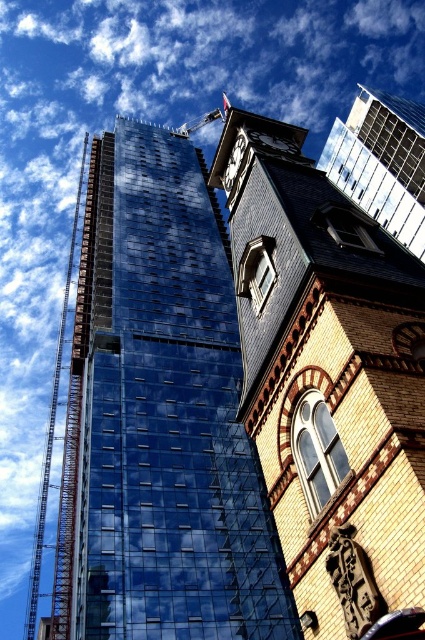
Question: Which of the following is the closest to the observer?

Choices:
 (A) yellow brick clock tower at upper center
 (B) black metal clock at upper center
 (C) metallic scaffolding at left

Answer: (A)

Question: In this image, where is glassy reflective skyscraper at upper center located relative to polished brass clock at upper center?

Choices:
 (A) below
 (B) above

Answer: (B)

Question: Which object is positioned farthest from the polished brass clock at upper center?

Choices:
 (A) shiny glass building at center
 (B) glassy reflective skyscraper at upper center
 (C) black metal clock at upper center
 (D) yellow brick clock tower at upper center

Answer: (A)

Question: Is glassy reflective skyscraper at upper center below metallic scaffolding at left?

Choices:
 (A) yes
 (B) no

Answer: (B)

Question: Is shiny glass building at center closer to camera compared to polished brass clock at upper center?

Choices:
 (A) yes
 (B) no

Answer: (B)

Question: Which of the following is the farthest from the observer?

Choices:
 (A) metallic scaffolding at left
 (B) shiny glass building at center
 (C) polished brass clock at upper center

Answer: (A)